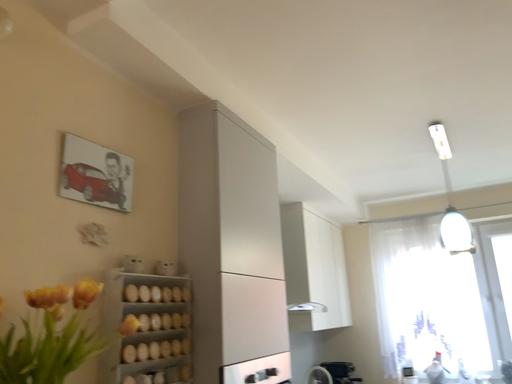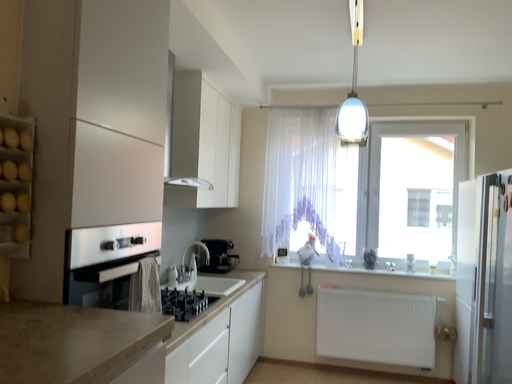
Question: Which way did the camera rotate in the video?

Choices:
 (A) rotated downward
 (B) rotated upward

Answer: (A)